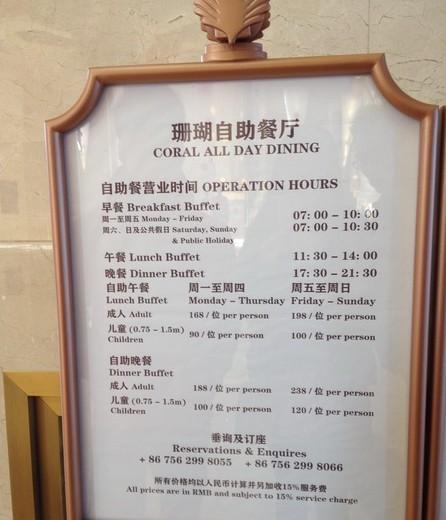
This screenshot has width=446, height=520. I want to click on right side of menu frame, so click(420, 333).